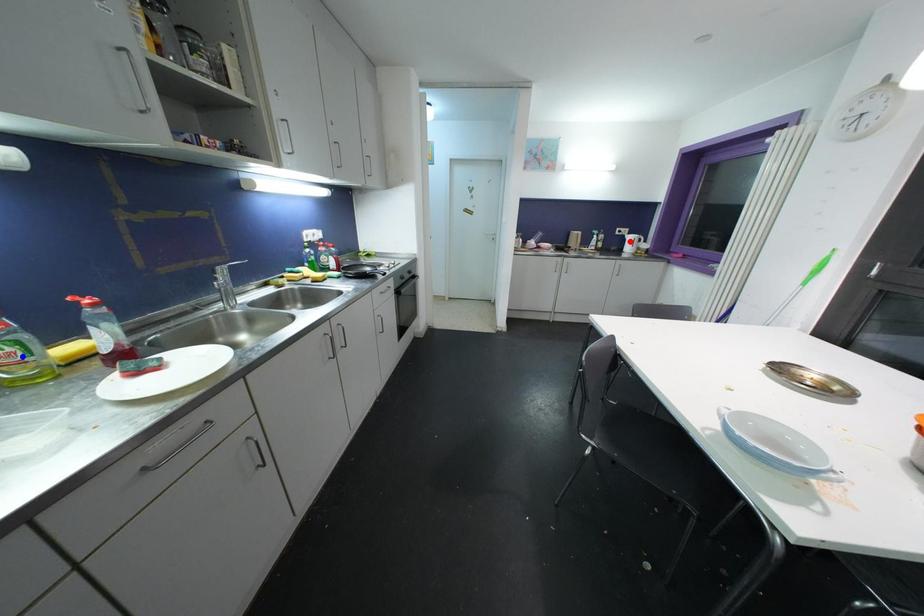
Question: Which of the two points in the image is closer to the camera?

Choices:
 (A) Blue point is closer.
 (B) Red point is closer.

Answer: (A)